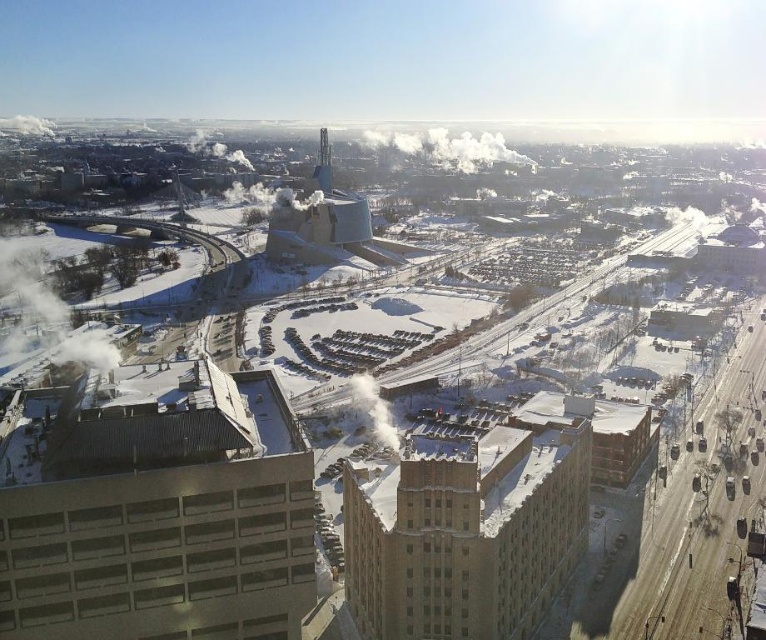
In the scene shown: Who is lower down, gray concrete building at lower left or brown brick building at lower right?

brown brick building at lower right

How much distance is there between gray concrete building at lower left and brown brick building at lower right?

The distance of gray concrete building at lower left from brown brick building at lower right is 110.98 feet.

You are a GUI agent. You are given a task and a screenshot of the screen. Output one action in this format:
    pyautogui.click(x=<x>, y=<y>)
    Task: Click on the gray concrete building at lower left
    The image size is (766, 640).
    Given the screenshot: What is the action you would take?
    pyautogui.click(x=159, y=513)